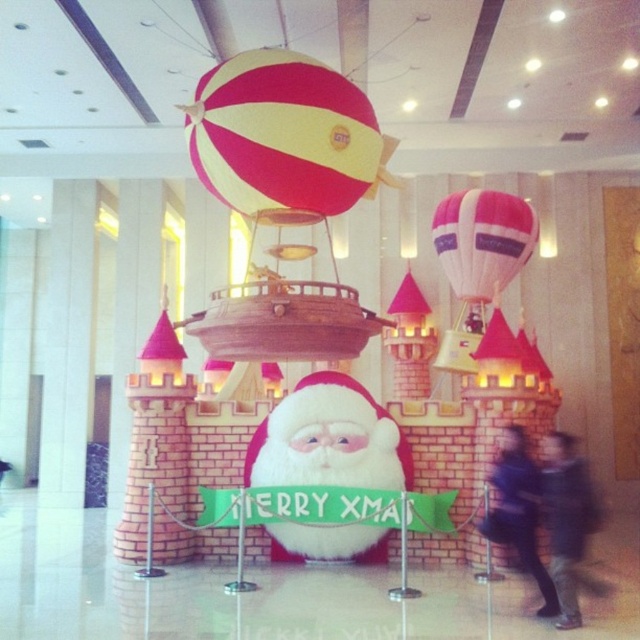
You are standing in front of the festive Christmas display and notice the pink fabric balloon at center. Where exactly is it positioned in relation to the Santa Claus figure?

The pink fabric balloon at center is located at point coordinates of 0.377 on the x axis and 0.755 on the y axis.

You are standing in the festive display and want to take a photo of both the yellow and red striped balloon at upper center and the dark blue jacket at lower right. Which object will appear higher in the photo?

The yellow and red striped balloon at upper center will appear higher in the photo since it is positioned above the dark blue jacket at lower right.

You are standing in front of the festive Christmas display and want to know which of the two points, point [198,83] or point [573,609], is closer to you. Can you determine this based on their positions?

Point [198,83] is further to the camera than point [573,609], so the closer point to you is point [573,609].